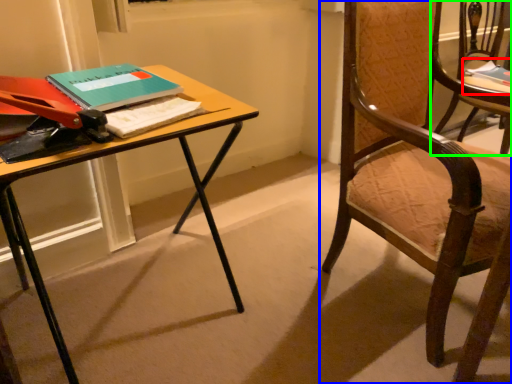
Question: Estimate the real-world distances between objects in this image. Which object is farther from book (highlighted by a red box), chair (highlighted by a blue box) or chair (highlighted by a green box)?

Choices:
 (A) chair
 (B) chair

Answer: (A)